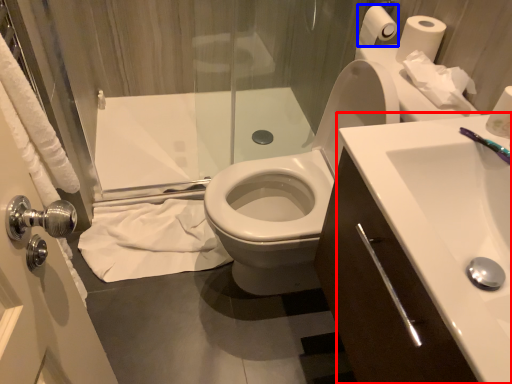
Question: Which object appears farthest to the camera in this image, sink (highlighted by a red box) or toilet paper (highlighted by a blue box)?

Choices:
 (A) sink
 (B) toilet paper

Answer: (B)